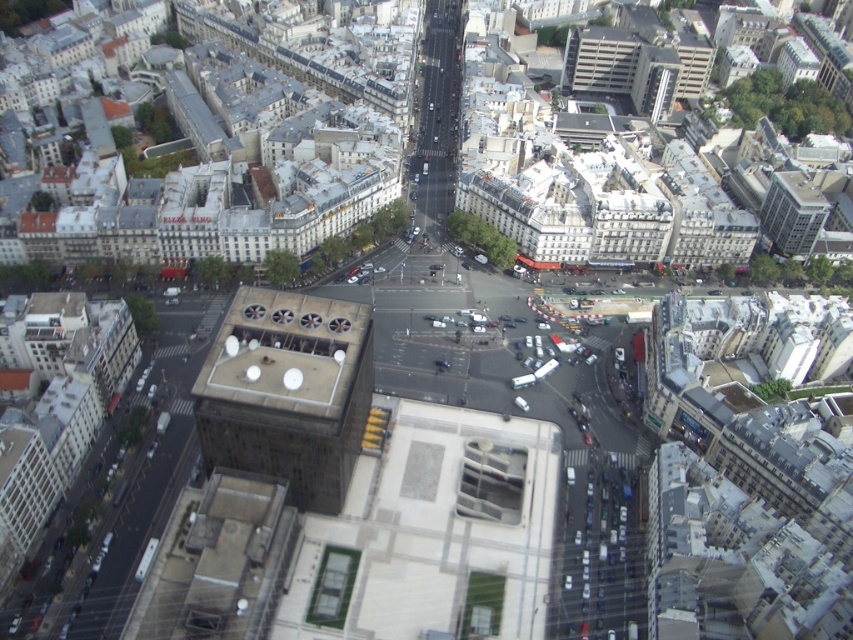
Question: Can you confirm if dark gray concrete building at center is bigger than glassy reflective skyscraper at upper right?

Choices:
 (A) no
 (B) yes

Answer: (B)

Question: Does dark gray concrete building at center appear under glassy reflective skyscraper at upper right?

Choices:
 (A) no
 (B) yes

Answer: (B)

Question: Which of the following is the farthest from the observer?

Choices:
 (A) glassy reflective skyscraper at upper right
 (B) dark gray concrete building at center

Answer: (A)

Question: Observing the image, what is the correct spatial positioning of dark gray concrete building at center in reference to glassy reflective skyscraper at upper right?

Choices:
 (A) left
 (B) right

Answer: (A)

Question: Which point is closer to the camera?

Choices:
 (A) dark gray concrete building at center
 (B) glassy reflective skyscraper at upper right

Answer: (A)

Question: Among these objects, which one is farthest from the camera?

Choices:
 (A) glassy reflective skyscraper at upper right
 (B) dark gray concrete building at center

Answer: (A)